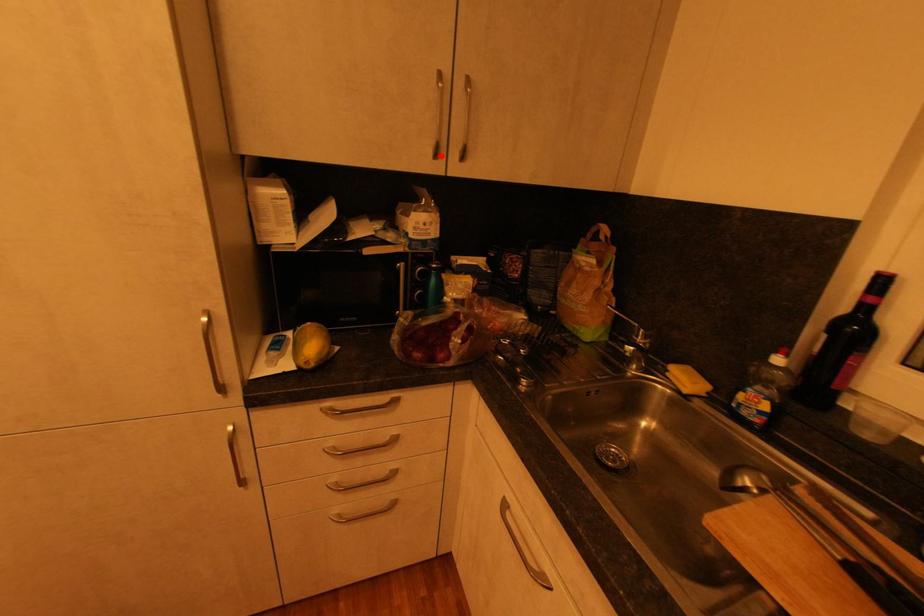
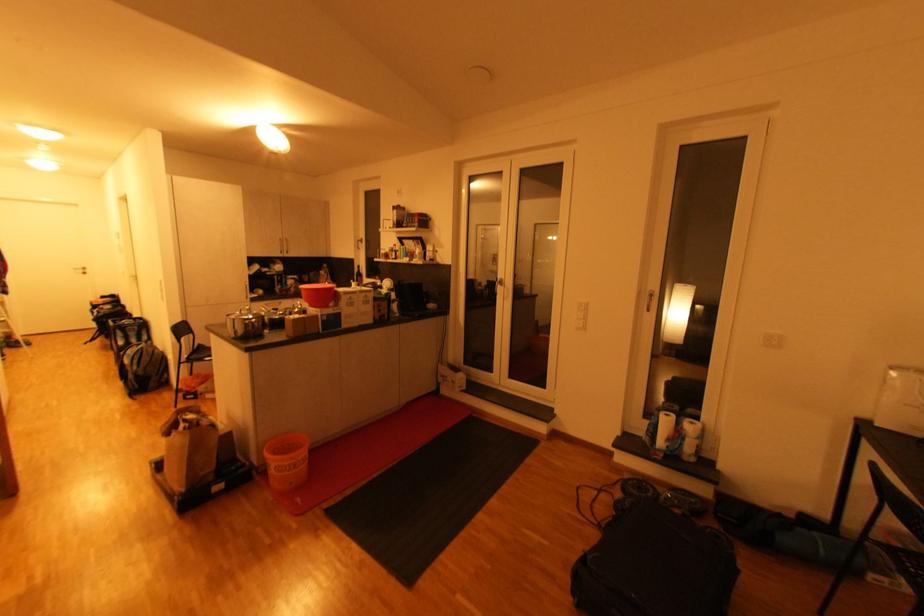
Find the pixel in the second image that matches the highlighted location in the first image.

(286, 254)